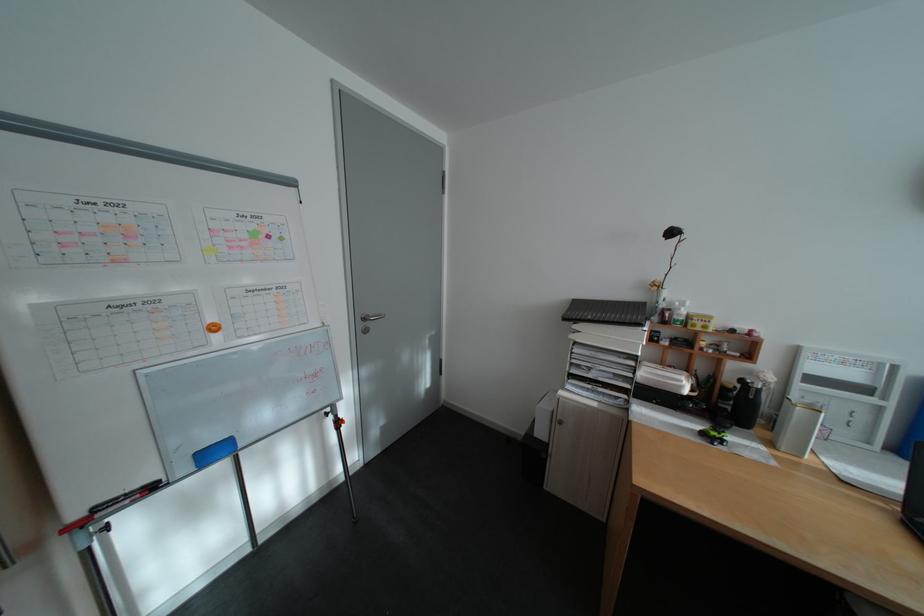
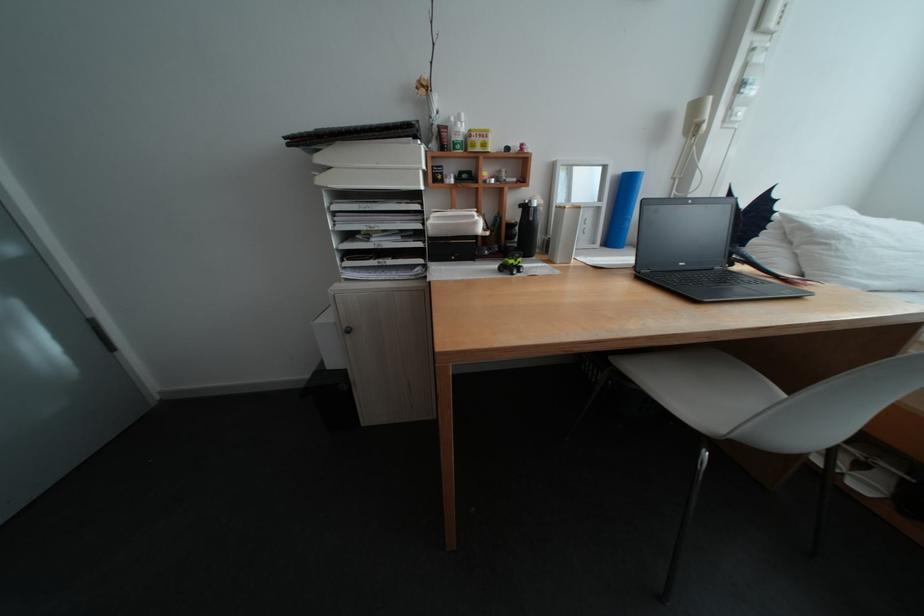
In the second image, find the point that corresponds to [589,328] in the first image.

(333, 160)